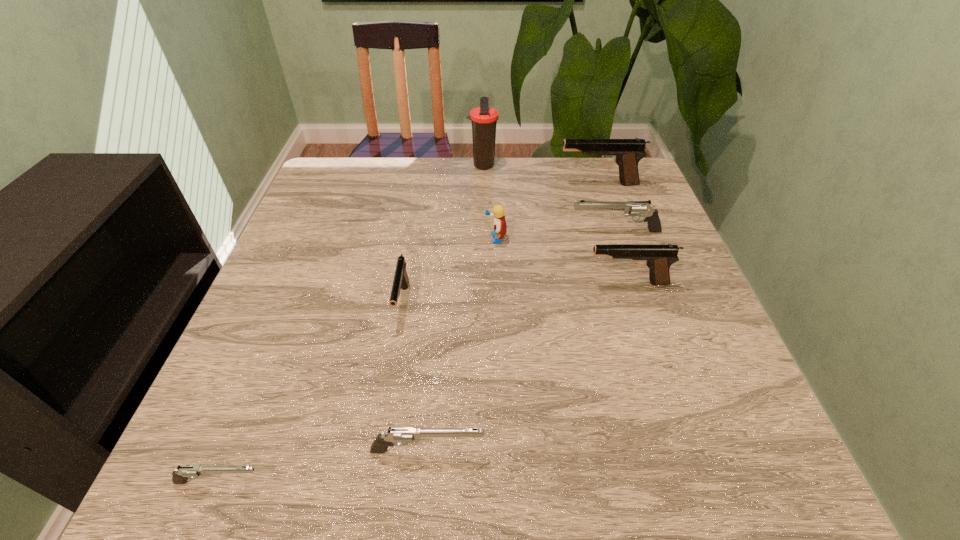
You are a GUI agent. You are given a task and a screenshot of the screen. Output one action in this format:
    pyautogui.click(x=<x>, y=<y>)
    Task: Click on the pistol that is at the far edge
    This screenshot has width=960, height=540.
    Given the screenshot: What is the action you would take?
    pyautogui.click(x=627, y=153)

You are a GUI agent. You are given a task and a screenshot of the screen. Output one action in this format:
    pyautogui.click(x=<x>, y=<y>)
    Task: Click on the object situated at the left edge
    
    Given the screenshot: What is the action you would take?
    pyautogui.click(x=180, y=475)

This screenshot has width=960, height=540. Find the location of `object positioned at the near left corner`. object positioned at the near left corner is located at coordinates (180, 475).

Find the location of a particular element. The image size is (960, 540). object that is at the far right corner is located at coordinates (627, 153).

You are a GUI agent. You are given a task and a screenshot of the screen. Output one action in this format:
    pyautogui.click(x=<x>, y=<y>)
    Task: Click on the vacant space at the far edge of the desktop
    The image size is (960, 540).
    Given the screenshot: What is the action you would take?
    pyautogui.click(x=388, y=159)

Image resolution: width=960 pixels, height=540 pixels. Identify the location of free space at the near edge of the desktop. (431, 453).

In order to click on free space at the left edge in this screenshot , I will do `click(353, 243)`.

The width and height of the screenshot is (960, 540). Find the location of `vacant region at the right edge`. vacant region at the right edge is located at coordinates (760, 433).

Find the location of `free space at the far right corner`. free space at the far right corner is located at coordinates (610, 180).

At what (x,y) coordinates should I click in order to perform the action: click on vacant area between the leftmost pistol and the second farthest pistol. Please return your answer as a coordinate pair (x, y). Image resolution: width=960 pixels, height=540 pixels. Looking at the image, I should click on (418, 356).